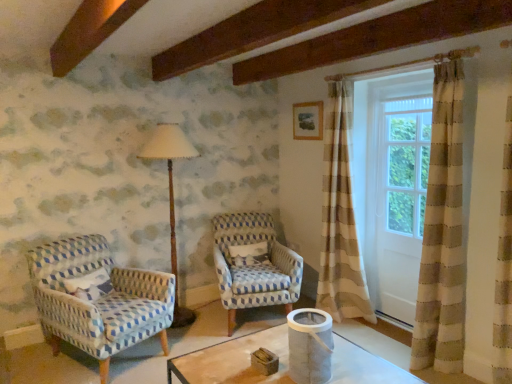
Image resolution: width=512 pixels, height=384 pixels. Find the location of `empty space that is ontop of white wood screen door at right`. empty space that is ontop of white wood screen door at right is located at coordinates (405, 89).